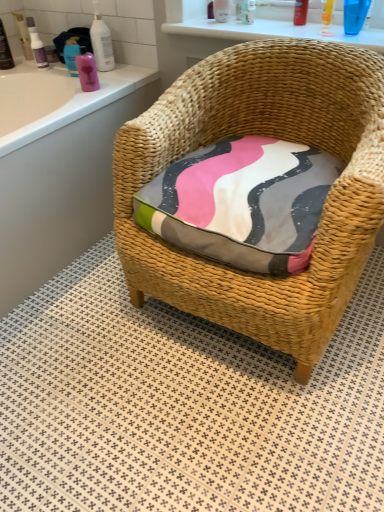
The width and height of the screenshot is (384, 512). Find the location of `free space above textured fabric pillow at center (from a real-world perspective)`. free space above textured fabric pillow at center (from a real-world perspective) is located at coordinates (265, 159).